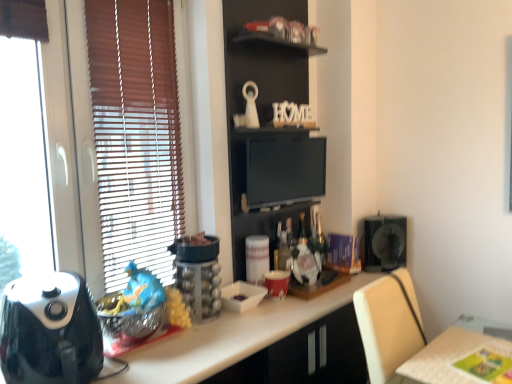
Question: Does point (181, 284) appear closer or farther from the camera than point (155, 344)?

Choices:
 (A) farther
 (B) closer

Answer: (A)

Question: From a real-world perspective, is metallic silver blender at left, the second appliance from the left, physically located above or below white glossy countertop at center?

Choices:
 (A) below
 (B) above

Answer: (B)

Question: Estimate the real-world distances between objects in this image. Which object is closer to the matte black monitor at center?

Choices:
 (A) black glossy air fryer at left, which is the first appliance from front to back
 (B) black plastic fan at right, placed as the sixth appliance when sorted from left to right
 (C) metallic silver blender at left, the 5th appliance positioned from the right
 (D) wooden bookshelf at upper center
 (E) matte red cup at center, the 3th appliance viewed from the back

Answer: (D)

Question: Which is farther from the white glossy countertop at center?

Choices:
 (A) wooden bookshelf at upper center
 (B) metallic silver blender at left, positioned as the fifth appliance in back-to-front order
 (C) matte red cup at center, the fifth appliance from the left
 (D) light brown wooden table at lower right
 (E) black glossy air fryer at left, which is the 6th appliance in right-to-left order

Answer: (A)